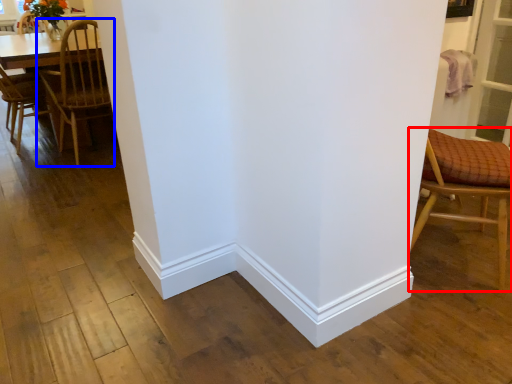
Question: Which object is further to the camera taking this photo, chair (highlighted by a red box) or chair (highlighted by a blue box)?

Choices:
 (A) chair
 (B) chair

Answer: (B)